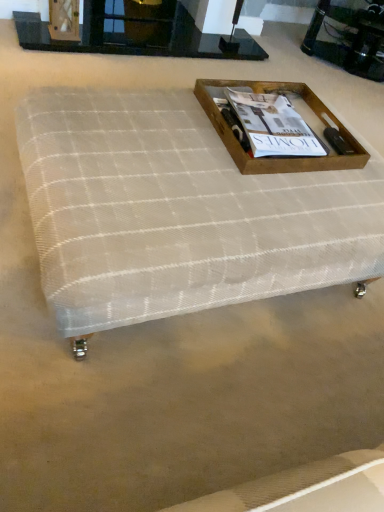
Question: Does white mesh ottoman at center appear on the right side of matte brown wooden tray at upper center?

Choices:
 (A) yes
 (B) no

Answer: (B)

Question: Can you confirm if white mesh ottoman at center is shorter than matte brown wooden tray at upper center?

Choices:
 (A) no
 (B) yes

Answer: (A)

Question: Is white mesh ottoman at center positioned with its back to matte brown wooden tray at upper center?

Choices:
 (A) no
 (B) yes

Answer: (A)

Question: From the image's perspective, is white mesh ottoman at center above matte brown wooden tray at upper center?

Choices:
 (A) yes
 (B) no

Answer: (B)

Question: Is the depth of white mesh ottoman at center less than that of matte brown wooden tray at upper center?

Choices:
 (A) yes
 (B) no

Answer: (A)

Question: Relative to black glass fireplace at upper center, is wooden tray at center in front or behind?

Choices:
 (A) behind
 (B) front

Answer: (B)

Question: Choose the correct answer: Is wooden tray at center inside black glass fireplace at upper center or outside it?

Choices:
 (A) inside
 (B) outside

Answer: (B)

Question: Is point (195, 93) positioned closer to the camera than point (178, 41)?

Choices:
 (A) farther
 (B) closer

Answer: (B)

Question: Is wooden tray at center taller or shorter than black glass fireplace at upper center?

Choices:
 (A) short
 (B) tall

Answer: (B)

Question: Do you think wooden tray at center is within matte brown wooden tray at upper center, or outside of it?

Choices:
 (A) outside
 (B) inside

Answer: (B)

Question: From the image's perspective, is wooden tray at center located above or below matte brown wooden tray at upper center?

Choices:
 (A) below
 (B) above

Answer: (B)

Question: Is wooden tray at center taller or shorter than matte brown wooden tray at upper center?

Choices:
 (A) tall
 (B) short

Answer: (B)

Question: Is wooden tray at center bigger or smaller than matte brown wooden tray at upper center?

Choices:
 (A) big
 (B) small

Answer: (A)

Question: Is black glass fireplace at upper center in front of or behind shiny black glass tray at upper right in the image?

Choices:
 (A) front
 (B) behind

Answer: (A)

Question: From a real-world perspective, relative to shiny black glass tray at upper right, is black glass fireplace at upper center vertically above or below?

Choices:
 (A) below
 (B) above

Answer: (A)